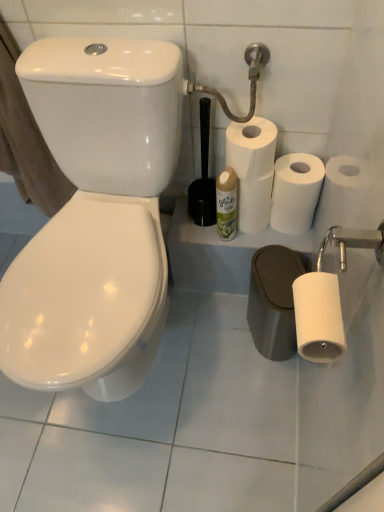
Question: From a real-world perspective, is white matte paper towel at center positioned above or below white matte toilet paper at lower right, the 3th toilet paper viewed from the back?

Choices:
 (A) below
 (B) above

Answer: (A)

Question: Choose the correct answer: Is white matte paper towel at center inside white matte toilet paper at lower right, the 3th toilet paper viewed from the back, or outside it?

Choices:
 (A) outside
 (B) inside

Answer: (A)

Question: Considering the real-world distances, which object is closest to the brown cotton bath towel at left?

Choices:
 (A) metallic silver shower head at upper right
 (B) white matte toilet paper at center right, placed as the 1th toilet paper when sorted from top to bottom
 (C) white matte toilet paper at upper right, the second toilet paper when ordered from top to bottom
 (D) green matte spray can at center
 (E) white matte toilet paper at lower right, which appears as the 1th toilet paper when viewed from the front

Answer: (A)

Question: Which object is the farthest from the white matte paper towel at center?

Choices:
 (A) green matte spray can at center
 (B) metallic silver shower head at upper right
 (C) white matte toilet paper at center right, placed as the 1th toilet paper when sorted from top to bottom
 (D) white matte toilet paper at upper right, the second toilet paper when ordered from top to bottom
 (E) brown cotton bath towel at left

Answer: (E)